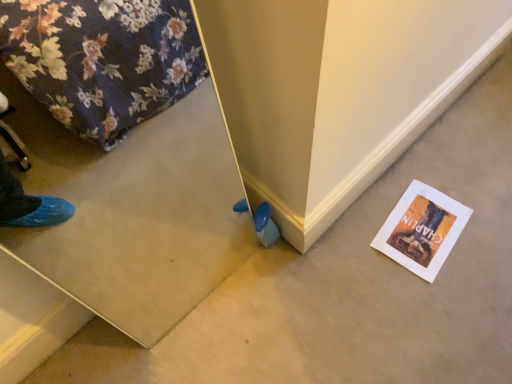
Locate an element on the screen. The height and width of the screenshot is (384, 512). empty space that is to the right of white paper at lower right is located at coordinates coord(478,217).